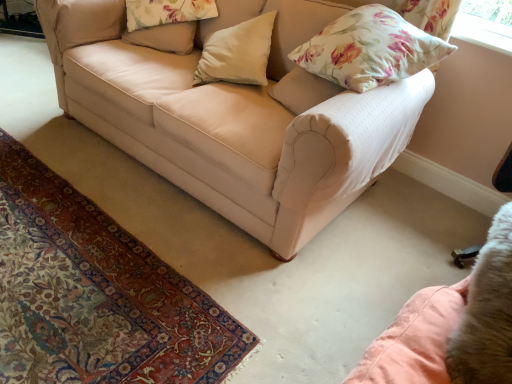
Question: In terms of width, does floral fabric pillow at upper right, the third pillow from the left, look wider or thinner when compared to beige fabric pillow at upper center, which ranks as the 1th pillow in left-to-right order?

Choices:
 (A) wide
 (B) thin

Answer: (A)

Question: Based on their positions, is floral fabric pillow at upper right, which is the first pillow in right-to-left order, located to the left or right of beige fabric pillow at upper center, which ranks as the 1th pillow in left-to-right order?

Choices:
 (A) right
 (B) left

Answer: (A)

Question: Which is nearer to the white matte pillow at center, the 2th pillow from the right?

Choices:
 (A) beige fabric pillow at upper center, which ranks as the 1th pillow in left-to-right order
 (B) floral fabric pillow at upper right, which is the first pillow in right-to-left order
 (C) metallic silver swivel chair at lower right
 (D) beige fabric couch at center

Answer: (D)

Question: Which object is positioned farthest from the floral fabric pillow at upper right, which is the first pillow in right-to-left order?

Choices:
 (A) metallic silver swivel chair at lower right
 (B) beige fabric pillow at upper center, positioned as the 3th pillow in right-to-left order
 (C) beige fabric couch at center
 (D) white matte pillow at center, the 2th pillow from the right

Answer: (B)